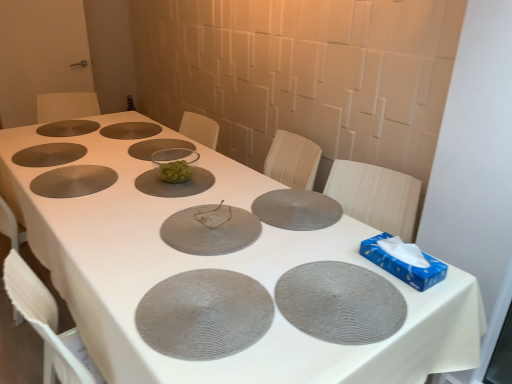
You are a GUI agent. You are given a task and a screenshot of the screen. Output one action in this format:
    pyautogui.click(x=<x>, y=<y>)
    Task: Click on the vacant area that lies between matte gray placemat at center, which ranks as the 4th glass plate in front-to-back order, and clear glass bowl at center, marked as the 6th glass plate in a front-to-back arrangement
    This screenshot has width=512, height=384.
    Given the screenshot: What is the action you would take?
    pyautogui.click(x=224, y=182)